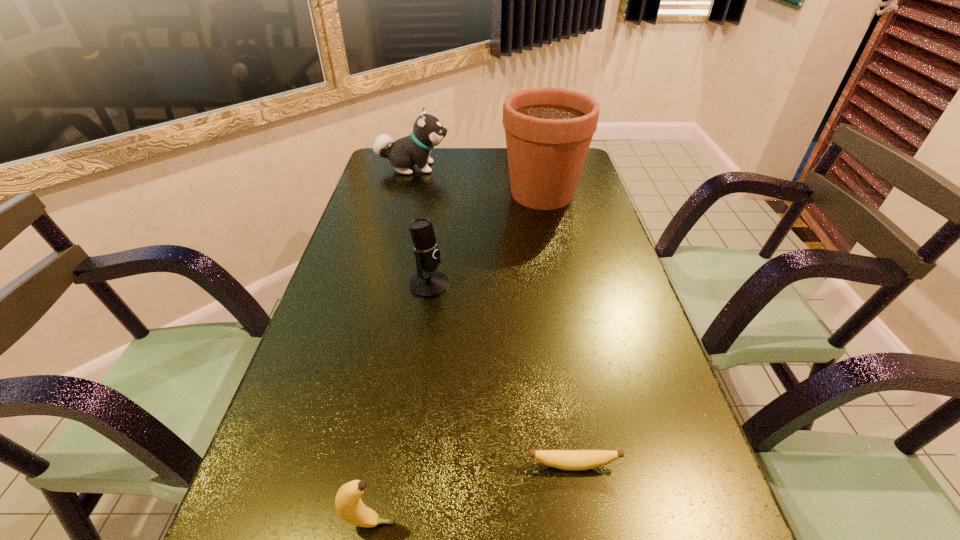
Where is `the tallest object`? the tallest object is located at coordinates (548, 131).

This screenshot has height=540, width=960. I want to click on puppy, so click(428, 132).

Locate an element on the screen. The height and width of the screenshot is (540, 960). the third farthest object is located at coordinates (428, 282).

The width and height of the screenshot is (960, 540). Find the location of `the nearer banana`. the nearer banana is located at coordinates (349, 505).

Locate an element on the screen. the fourth tallest object is located at coordinates (349, 505).

At what (x,y) coordinates should I click in order to perform the action: click on the fourth farthest object. Please return your answer as a coordinate pair (x, y). Looking at the image, I should click on (563, 459).

Locate an element on the screen. the shorter banana is located at coordinates (563, 459).

Locate an element on the screen. The height and width of the screenshot is (540, 960). free space located on the front of the tallest object is located at coordinates (555, 254).

Identify the location of vacant area located 0.100m at the face of the puppy. (478, 167).

Locate an element on the screen. The image size is (960, 540). free space located on the front of the microphone is located at coordinates (424, 323).